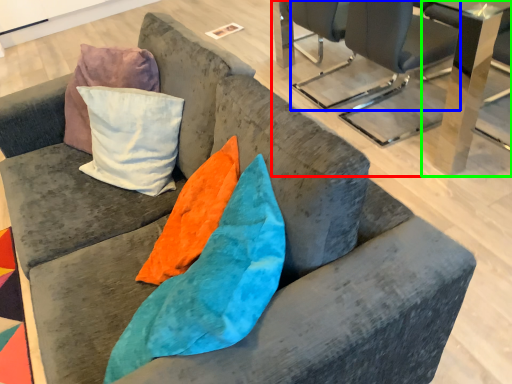
Question: Based on their relative distances, which object is farther from table (highlighted by a red box)? Choose from chair (highlighted by a blue box) and table (highlighted by a green box).

Choices:
 (A) chair
 (B) table

Answer: (A)